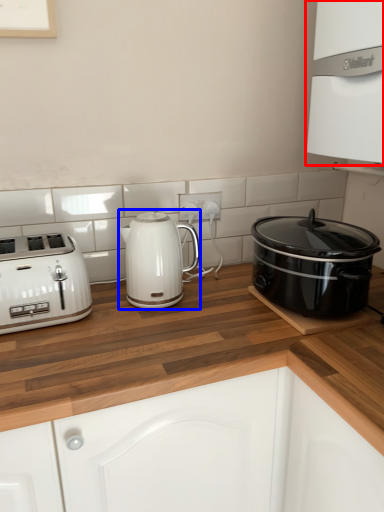
Question: Which of the following is the farthest to the observer, oven (highlighted by a red box) or kettle (highlighted by a blue box)?

Choices:
 (A) oven
 (B) kettle

Answer: (B)